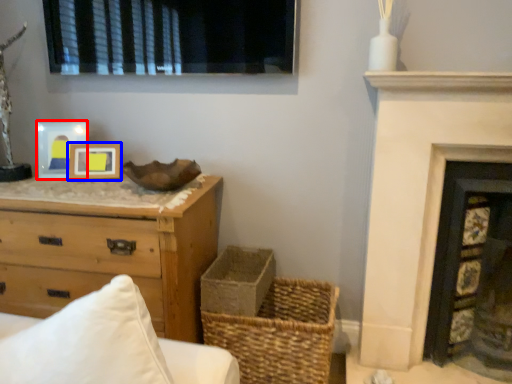
Question: Which of the following is the farthest to the observer, picture frame (highlighted by a red box) or picture frame (highlighted by a blue box)?

Choices:
 (A) picture frame
 (B) picture frame

Answer: (A)